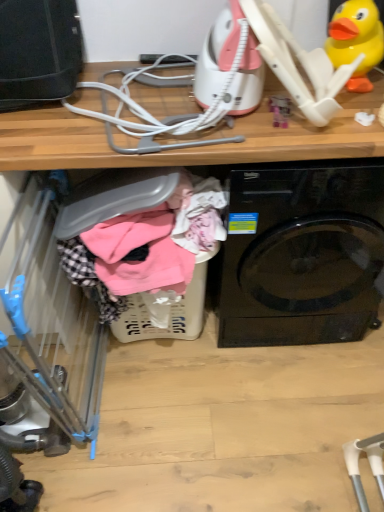
The height and width of the screenshot is (512, 384). I want to click on space that is in front of black glossy washing machine at center, so click(x=279, y=419).